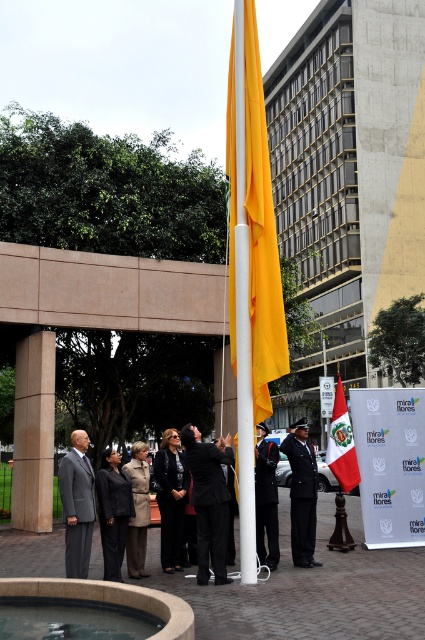
Question: Does yellow fabric flag at center come behind light brown leather coat at center?

Choices:
 (A) yes
 (B) no

Answer: (B)

Question: Which point is farther to the camera?

Choices:
 (A) (71, 464)
 (B) (167, 435)

Answer: (B)

Question: Where is yellow glossy flag pole at center located in relation to smooth stone fountain at lower left in the image?

Choices:
 (A) left
 (B) right

Answer: (B)

Question: Which point appears closest to the camera in this image?

Choices:
 (A) (342, 483)
 (B) (142, 461)
 (C) (263, 403)
 (D) (240, 205)

Answer: (C)

Question: Is yellow glossy flag pole at center closer to camera compared to black glossy suit at center?

Choices:
 (A) yes
 (B) no

Answer: (B)

Question: Which object appears farthest from the camera in this image?

Choices:
 (A) light brown leather coat at center
 (B) yellow glossy flag pole at center

Answer: (A)